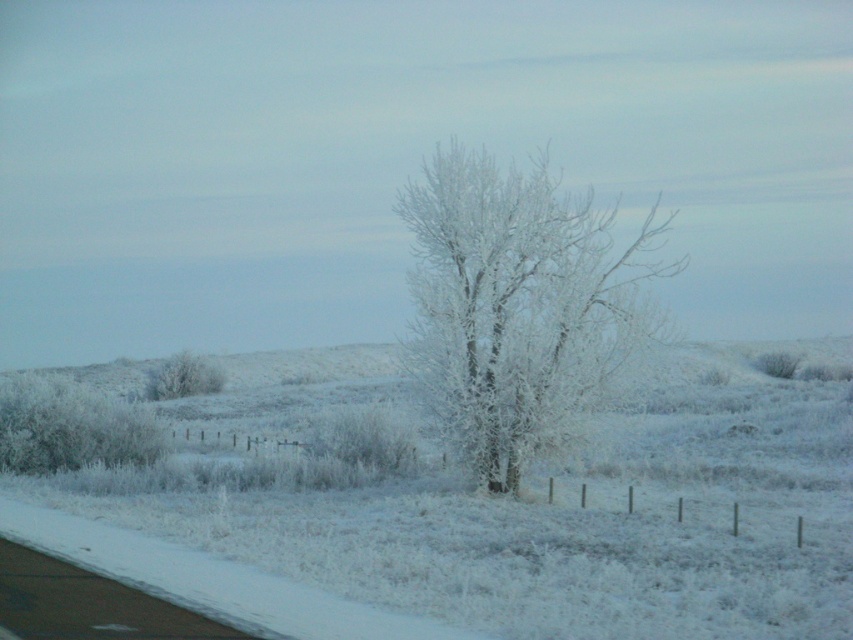
You are an observer standing at the edge of the snow road. You see the white frosty tree at center and the frosted white tree at left. Which tree is closer to you?

The white frosty tree at center is closer to you because it is in front of the frosted white tree at left.

You are an observer standing on the snow covered road. You see two trees in the scene, the white frosty tree at center and the frosted white tree at center. Which tree is taller?

The frosted white tree at center is taller than the white frosty tree at center.